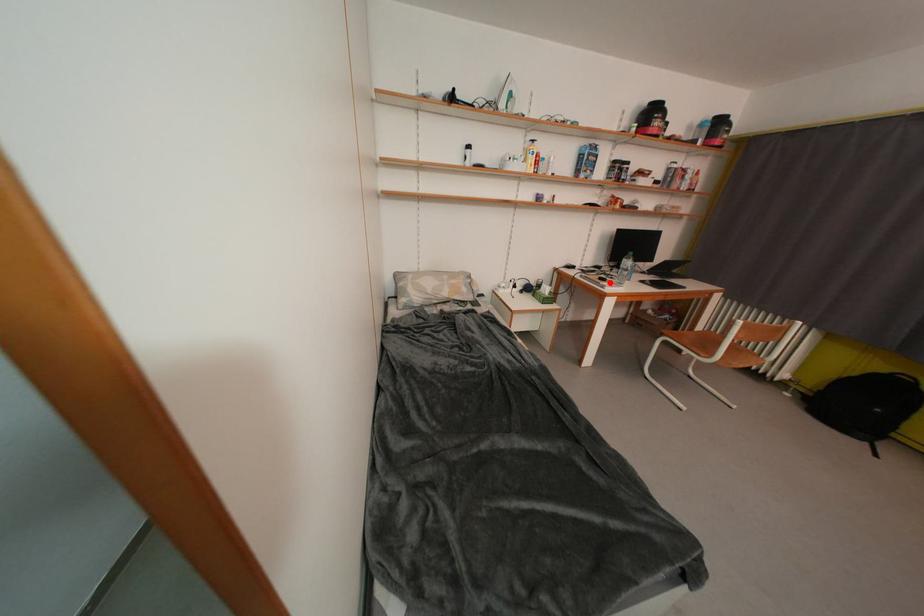
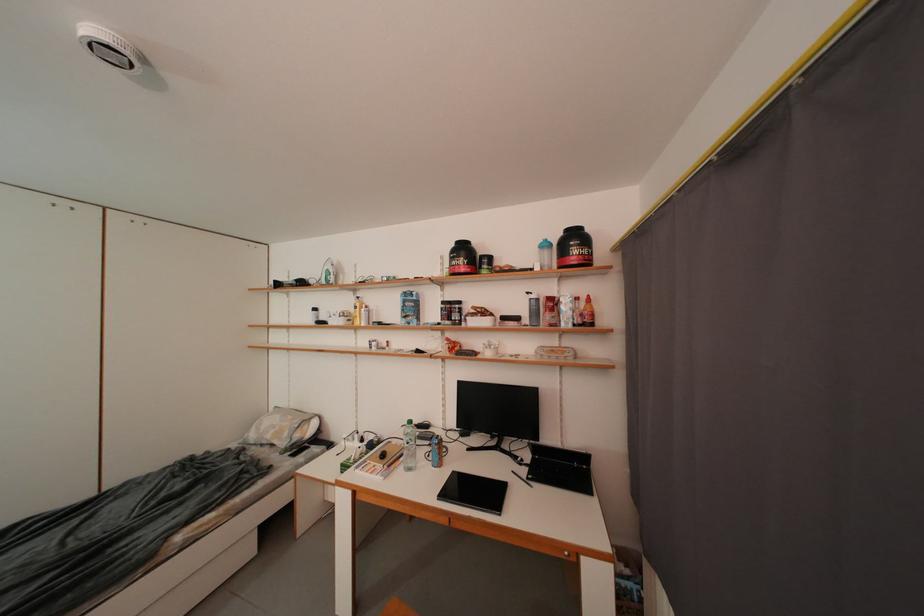
Where in the second image is the point corresponding to the highlighted location from the first image?

(391, 459)